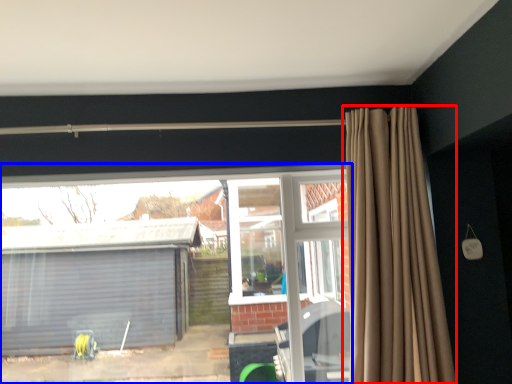
Question: Which of the following is the closest to the observer, curtain (highlighted by a red box) or window (highlighted by a blue box)?

Choices:
 (A) curtain
 (B) window

Answer: (A)